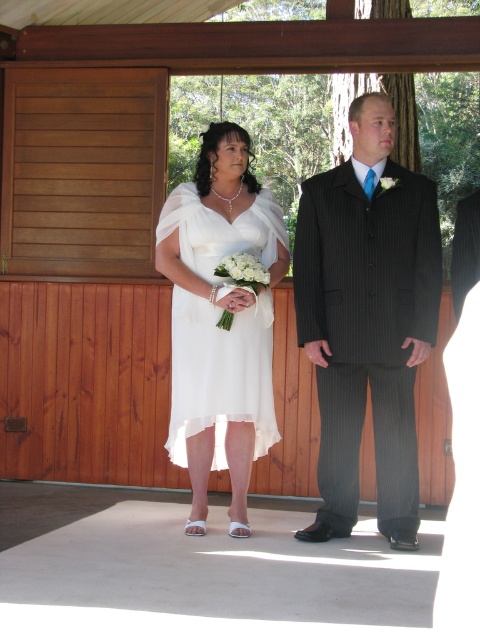
You are a photographer at the wedding and want to ensure both the black pinstripe suit at center and the ivory chiffon dress at center are in focus. Since the camera can only focus on one subject at a time, which one should you choose to focus on to ensure the other is also in focus?

The black pinstripe suit at center is located above the ivory chiffon dress at center. Since the camera focuses along a vertical plane, focusing on the higher subject ensures the lower one is also in focus.

You are a photographer positioned at the front of the pavilion. You need to focus your camera on the black pinstripe suit at center. What are the coordinates where you should aim your camera?

The coordinates where you should aim your camera are at point (367,320).